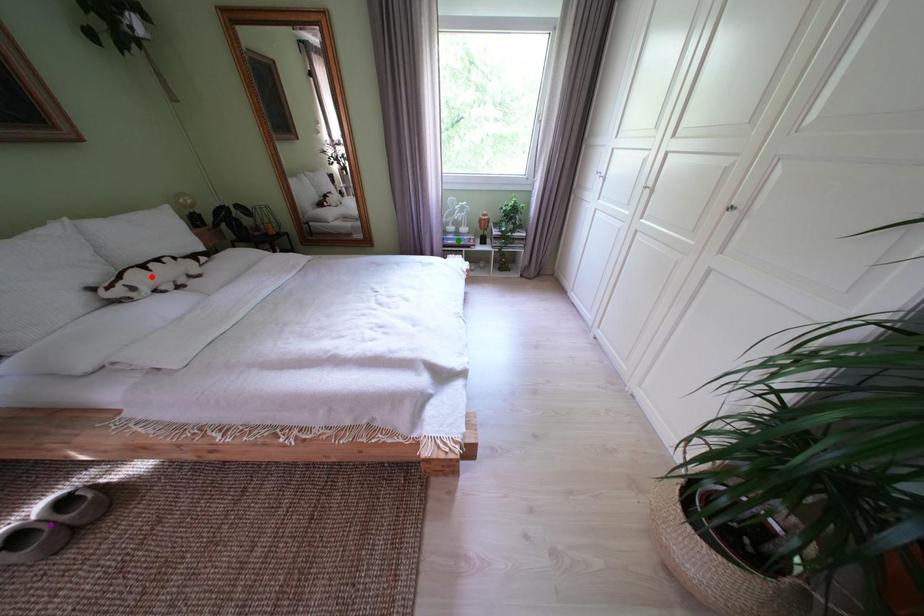
Order these from nearest to farthest:
1. red point
2. purple point
3. green point

purple point
red point
green point